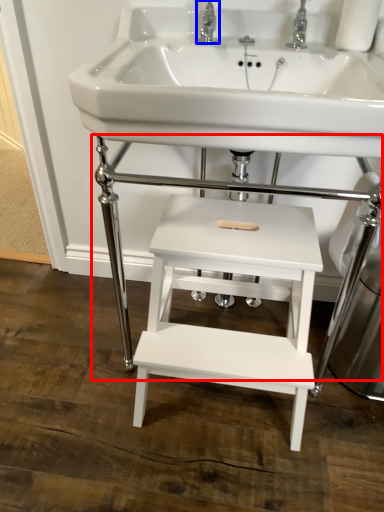
Question: Which object appears closest to the camera in this image, table (highlighted by a red box) or tap (highlighted by a blue box)?

Choices:
 (A) table
 (B) tap

Answer: (A)